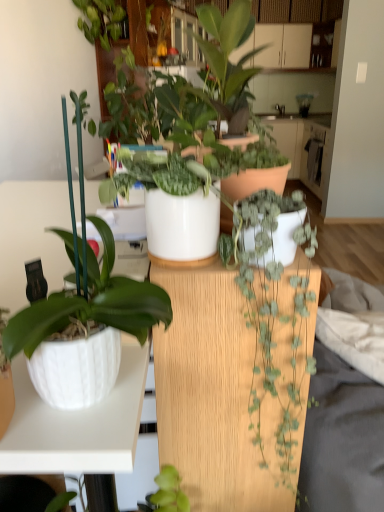
Question: Is white glossy pot at center, placed as the third houseplant when sorted from bottom to top, situated inside white glossy countertop at center or outside?

Choices:
 (A) outside
 (B) inside

Answer: (A)

Question: Considering their positions, is white glossy pot at center, placed as the third houseplant when sorted from bottom to top, located in front of or behind white glossy countertop at center?

Choices:
 (A) front
 (B) behind

Answer: (A)

Question: Which object is the farthest from the white glossy pot at left, the second houseplant in the bottom-to-top sequence?

Choices:
 (A) green matte plant at center, arranged as the 1th houseplant when ordered from the bottom
 (B) matte white pot at center, which appears as the fourth houseplant when ordered from the bottom
 (C) white glossy countertop at center
 (D) white glossy pot at center, placed as the third houseplant when sorted from bottom to top

Answer: (C)

Question: Estimate the real-world distances between objects in this image. Which object is farther from the white glossy pot at center, the 2th houseplant when ordered from top to bottom?

Choices:
 (A) matte white pot at center, acting as the 1th houseplant starting from the top
 (B) white glossy pot at left, the third houseplant when ordered from top to bottom
 (C) green matte plant at center, the fourth houseplant from the top
 (D) white glossy countertop at center

Answer: (D)